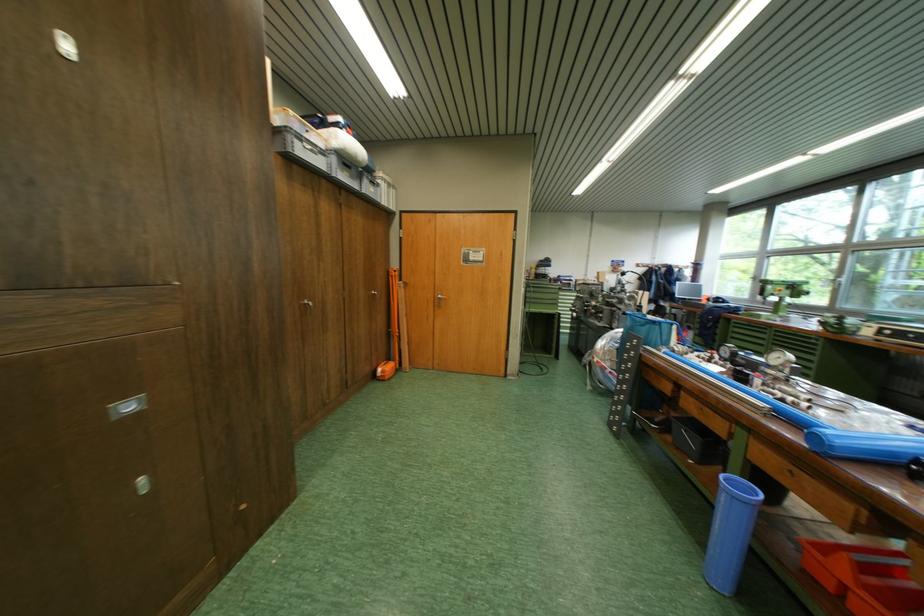
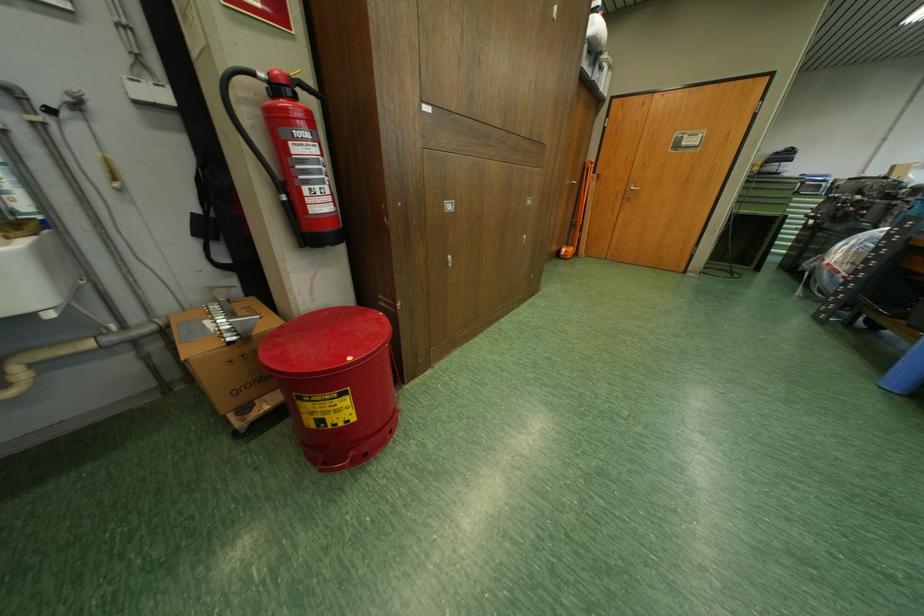
Find the pixel in the second image that matches [446,297] in the first image.

(638, 188)